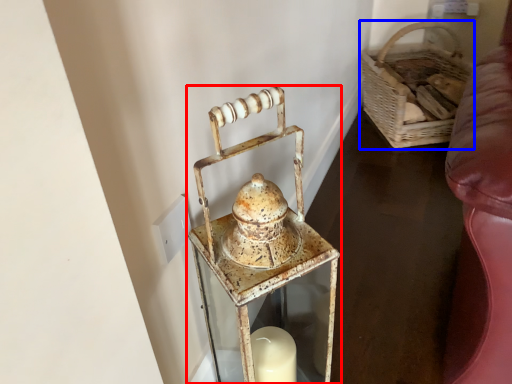
Question: Which point is closer to the camera, lantern (highlighted by a red box) or basket (highlighted by a blue box)?

Choices:
 (A) lantern
 (B) basket

Answer: (A)